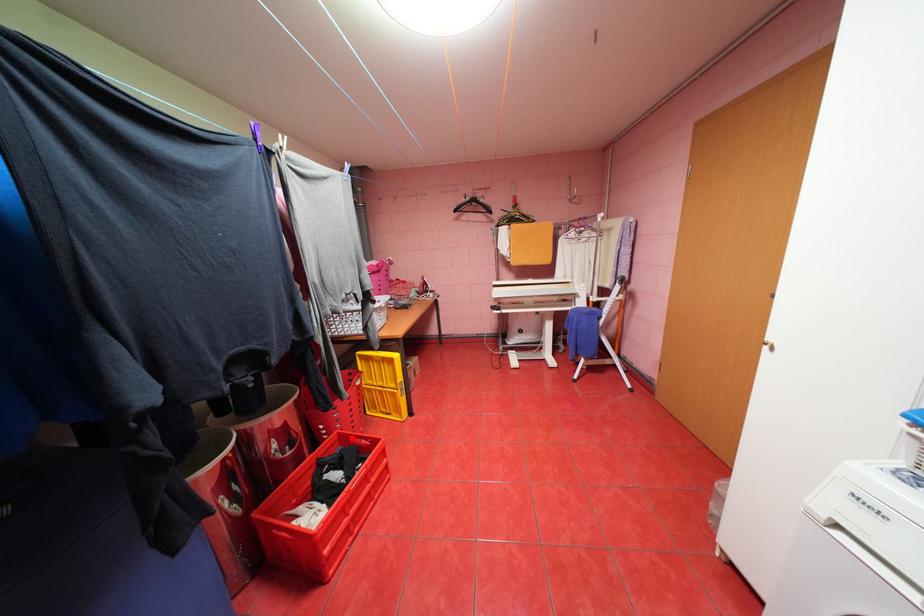
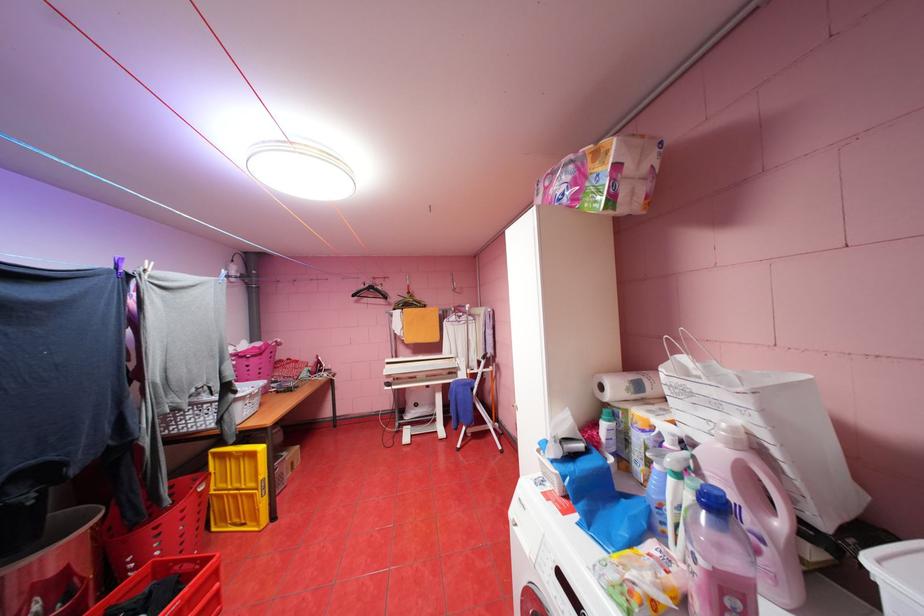
Question: A red point is marked in image1. In image2, is the corresponding 3D point closer to the camera or farther? Reply with the corresponding letter.

Choices:
 (A) The corresponding 3D point is closer.
 (B) The corresponding 3D point is farther.

Answer: (B)